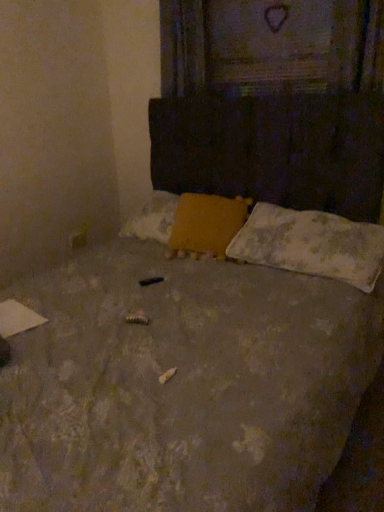
Question: Based on their sizes in the image, would you say wooden textured frame at upper center is bigger or smaller than yellow fabric pillow at center, acting as the 1th pillow starting from the left?

Choices:
 (A) small
 (B) big

Answer: (A)

Question: Considering the positions of point (296, 67) and point (201, 244), is point (296, 67) closer or farther from the camera than point (201, 244)?

Choices:
 (A) farther
 (B) closer

Answer: (A)

Question: Considering the real-world distances, which object is farthest from the wooden textured frame at upper center?

Choices:
 (A) yellow fabric pillow at center, acting as the 1th pillow starting from the left
 (B) white textured pillow at lower right, which ranks as the second pillow in left-to-right order

Answer: (A)

Question: Which is nearer to the yellow fabric pillow at center, acting as the 1th pillow starting from the left?

Choices:
 (A) white textured pillow at lower right, which ranks as the second pillow in left-to-right order
 (B) wooden textured frame at upper center

Answer: (A)